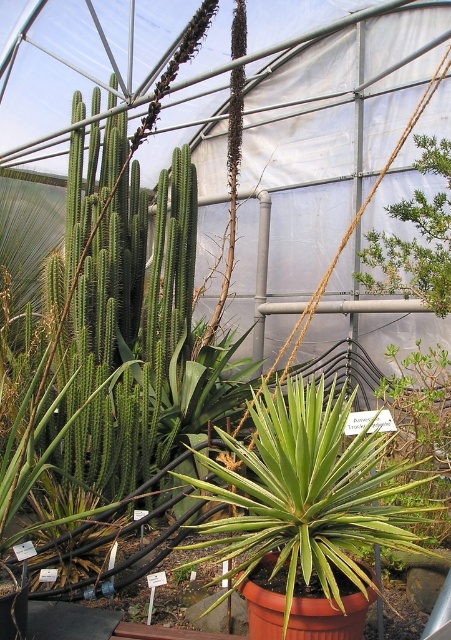
You are a gardener who wants to place a new small succulent pot between the green leafy plant at center and the green leafy shrub at upper right. Which one should you place it closer to if you want the new pot to be smaller than both existing plants?

You should place the new small succulent pot closer to the green leafy shrub at upper right because the green leafy shrub at upper right is smaller than the green leafy plant at center, so positioning the new pot near the smaller shrub ensures it remains smaller than both.

You are a gardener who needs to water the green leafy plant at center and the green leafy shrub at upper right. Based on their positions, which one would you water first if you start from the entrance of the greenhouse?

The green leafy plant at center is located below the green leafy shrub at upper right. Since the shrub is positioned higher up, the plant at the center is closer to the entrance. Therefore, you should water the green leafy plant at center first before reaching the higher shrub.

You are standing inside the greenhouse and want to move from point A to point B. Point A is at coordinate point (366, 577) and point B is at coordinate point (368, 273). According to the scene description, which point is closer to you when you are facing the greenhouse entrance?

Point A at coordinate point (366, 577) is closer to you because it is in front of point B at coordinate point (368, 273).